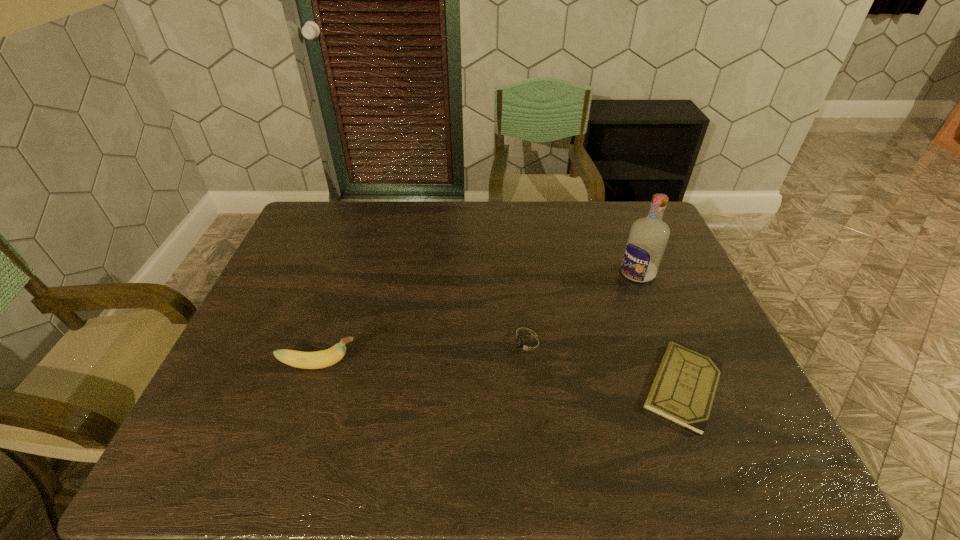
At what (x,y) coordinates should I click in order to perform the action: click on vacant spot on the desktop that is between the third shortest object and the shortest object and is positioned on the face of the watch. Please return your answer as a coordinate pair (x, y). The height and width of the screenshot is (540, 960). Looking at the image, I should click on (453, 373).

What are the coordinates of `vacant spot on the desktop that is between the banana and the shortest object and is positioned on the label of the farthest object` in the screenshot? It's located at (515, 376).